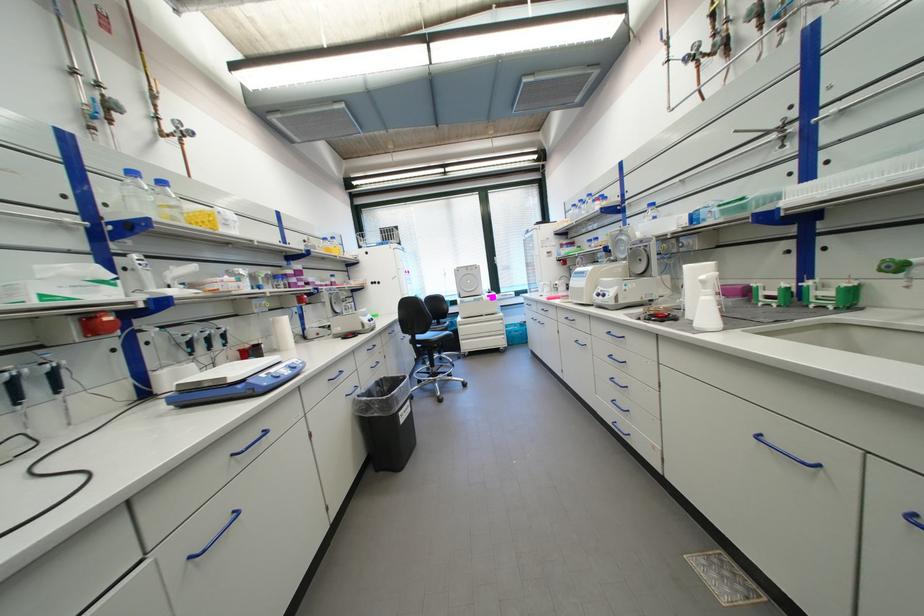
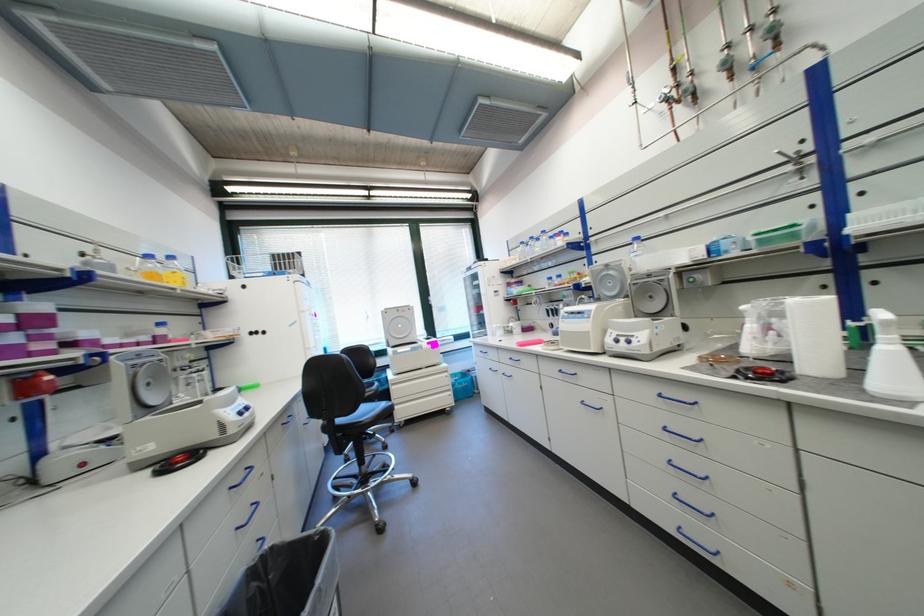
Question: The first image is from the beginning of the video and the second image is from the end. How did the camera likely rotate when shooting the video?

Choices:
 (A) Left
 (B) Right
 (C) Up
 (D) Down

Answer: (B)